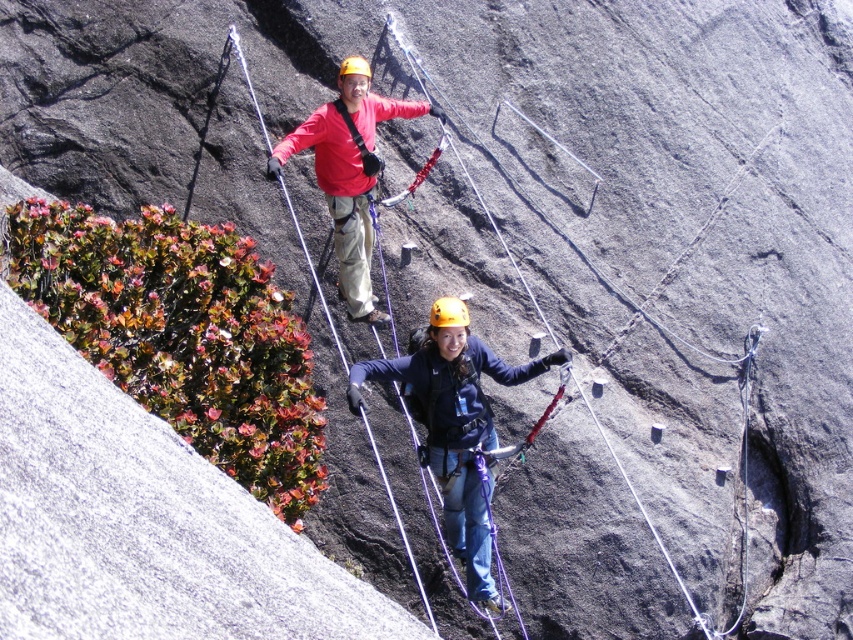
Does matte red jacket at upper center appear on the left side of yellow matte helmet at center?

Yes, matte red jacket at upper center is to the left of yellow matte helmet at center.

Who is higher up, matte red jacket at upper center or yellow matte helmet at center?

matte red jacket at upper center is above.

Is point (389, 116) positioned after point (439, 314)?

Yes, it is.

Find the location of a particular element. The height and width of the screenshot is (640, 853). matte red jacket at upper center is located at coordinates (349, 172).

Does matte blue jacket at center have a lesser height compared to matte red jacket at upper center?

Yes, matte blue jacket at center is shorter than matte red jacket at upper center.

Which of these two, matte blue jacket at center or matte red jacket at upper center, stands shorter?

With less height is matte blue jacket at center.

Who is more forward, (x=471, y=488) or (x=364, y=284)?

Point (x=471, y=488) is in front.

You are a GUI agent. You are given a task and a screenshot of the screen. Output one action in this format:
    pyautogui.click(x=<x>, y=<y>)
    Task: Click on the matte blue jacket at center
    The height and width of the screenshot is (640, 853).
    Given the screenshot: What is the action you would take?
    pyautogui.click(x=456, y=433)

Between point (483, 499) and point (444, 314), which one is positioned in front?

Point (444, 314)

Does point (461, 460) lie in front of point (445, 296)?

Yes.

Where is `matte blue jacket at center`? matte blue jacket at center is located at coordinates (456, 433).